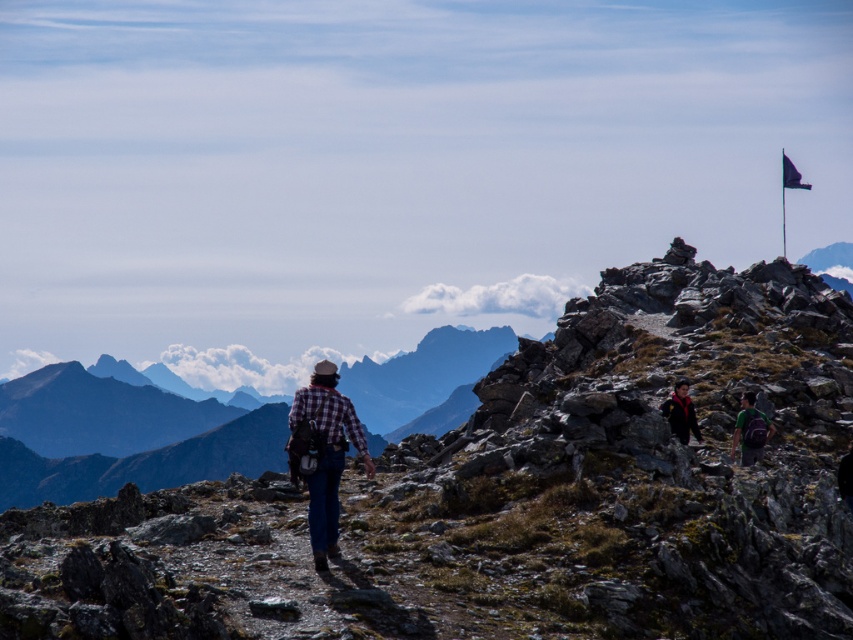
Between rugged stone mountain at upper right and plaid fabric shirt at center, which one is positioned higher?

plaid fabric shirt at center is higher up.

Between point (100, 477) and point (328, 419), which one is positioned in front?

Positioned in front is point (328, 419).

Identify the location of rugged stone mountain at upper right. (492, 493).

Is rugged stone mountain at upper right behind black fabric flag at upper right?

No, rugged stone mountain at upper right is closer to the viewer.

Which of these two, rugged stone mountain at upper right or black fabric flag at upper right, stands shorter?

With less height is rugged stone mountain at upper right.

Image resolution: width=853 pixels, height=640 pixels. What do you see at coordinates (492, 493) in the screenshot?
I see `rugged stone mountain at upper right` at bounding box center [492, 493].

You are a GUI agent. You are given a task and a screenshot of the screen. Output one action in this format:
    pyautogui.click(x=<x>, y=<y>)
    Task: Click on the rugged stone mountain at upper right
    The image size is (853, 640).
    Given the screenshot: What is the action you would take?
    pyautogui.click(x=492, y=493)

Can you confirm if plaid fabric shirt at center is bigger than black fleece jacket at upper right?

Yes.

Based on the photo, between plaid fabric shirt at center and black fleece jacket at upper right, which one appears on the left side from the viewer's perspective?

plaid fabric shirt at center

Measure the distance between point (316,531) and camera.

Point (316,531) is 133.85 feet from camera.

You are a GUI agent. You are given a task and a screenshot of the screen. Output one action in this format:
    pyautogui.click(x=<x>, y=<y>)
    Task: Click on the plaid fabric shirt at center
    Image resolution: width=853 pixels, height=640 pixels.
    Given the screenshot: What is the action you would take?
    pyautogui.click(x=326, y=452)